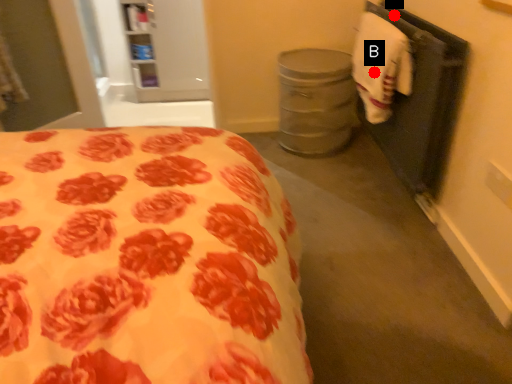
Question: Two points are circled on the image, labeled by A and B beside each circle. Which point is farther from the camera taking this photo?

Choices:
 (A) A is further
 (B) B is further

Answer: (A)